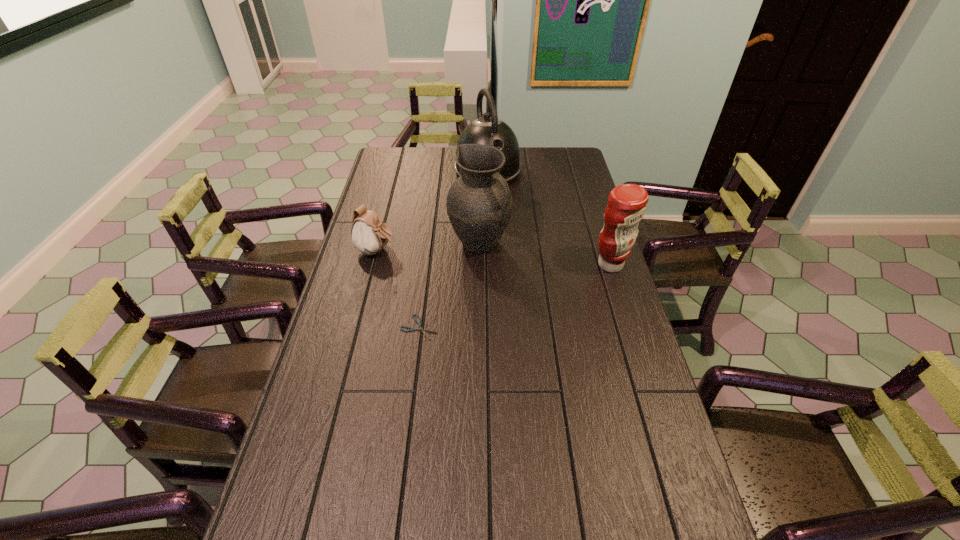
This screenshot has height=540, width=960. I want to click on empty location between the farthest object and the condiment, so click(x=549, y=218).

I want to click on free area in between the pouch and the nearest object, so pos(397,289).

This screenshot has width=960, height=540. In order to click on vacant area that lies between the kettle and the pouch in this screenshot , I will do `click(432, 211)`.

Where is `vacant space that is in between the pitcher and the condiment`? vacant space that is in between the pitcher and the condiment is located at coordinates (545, 253).

Locate an element on the screen. The image size is (960, 540). free spot between the pouch and the pitcher is located at coordinates (428, 246).

Identify the location of vacant space in between the shears and the pouch. The width and height of the screenshot is (960, 540). (397, 289).

Locate which object ranks fourth in proximity to the farthest object. Please provide its 2D coordinates. Your answer should be formatted as a tuple, i.e. [(x, y)], where the tuple contains the x and y coordinates of a point satisfying the conditions above.

[(419, 323)]

Identify the location of object that stands as the closest to the kettle. (479, 203).

Where is `vacant space that satisfies the following two spatial constraints: 1. on the front side of the pitcher; 2. on the left side of the rightmost object`? Image resolution: width=960 pixels, height=540 pixels. vacant space that satisfies the following two spatial constraints: 1. on the front side of the pitcher; 2. on the left side of the rightmost object is located at coordinates (480, 265).

Find the location of `free spot that satisfies the following two spatial constraints: 1. on the front side of the third shortest object; 2. on the right side of the fourth tallest object`. free spot that satisfies the following two spatial constraints: 1. on the front side of the third shortest object; 2. on the right side of the fourth tallest object is located at coordinates (372, 265).